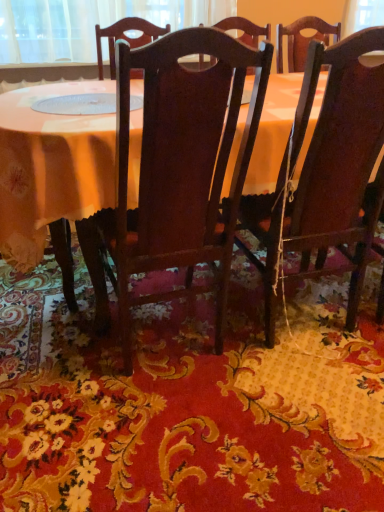
This screenshot has width=384, height=512. Identify the location of vacant space in front of dark wood chair at right, placed as the first chair when sorted from right to left. (296, 406).